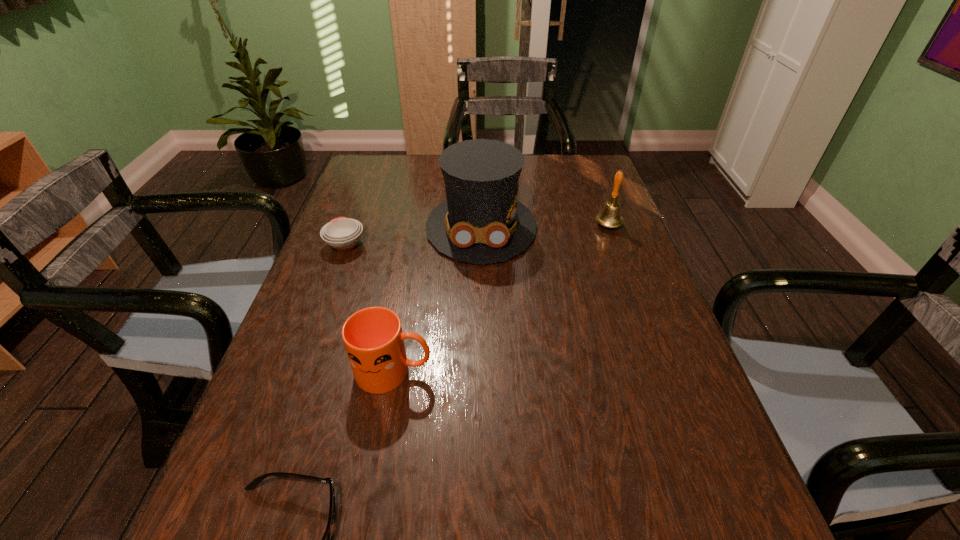
Identify the location of object at the left edge. (342, 233).

The image size is (960, 540). Find the location of `object that is at the right edge`. object that is at the right edge is located at coordinates (610, 216).

The width and height of the screenshot is (960, 540). What are the coordinates of `free space at the far edge` in the screenshot? It's located at (423, 158).

Where is `free space at the left edge`? This screenshot has width=960, height=540. free space at the left edge is located at coordinates (333, 354).

Locate an element on the screen. free location at the right edge of the desktop is located at coordinates (666, 318).

The image size is (960, 540). Find the location of `free location at the far left corner of the desktop`. free location at the far left corner of the desktop is located at coordinates (373, 189).

Where is `free point between the dress hat and the third tallest object`? free point between the dress hat and the third tallest object is located at coordinates (438, 299).

At what (x,y) coordinates should I click in order to perform the action: click on free space between the dress hat and the rightmost object. Please return your answer as a coordinate pair (x, y). Looking at the image, I should click on (544, 226).

You are a GUI agent. You are given a task and a screenshot of the screen. Output one action in this format:
    pyautogui.click(x=<x>, y=<y>)
    Task: Click on the vacant space in between the rightmost object and the dress hat
    This screenshot has height=540, width=960.
    Given the screenshot: What is the action you would take?
    pyautogui.click(x=544, y=226)

Select which object is the fourth closest to the rightmost object. Please provide its 2D coordinates. Your answer should be formatted as a tuple, i.e. [(x, y)], where the tuple contains the x and y coordinates of a point satisfying the conditions above.

[(253, 484)]